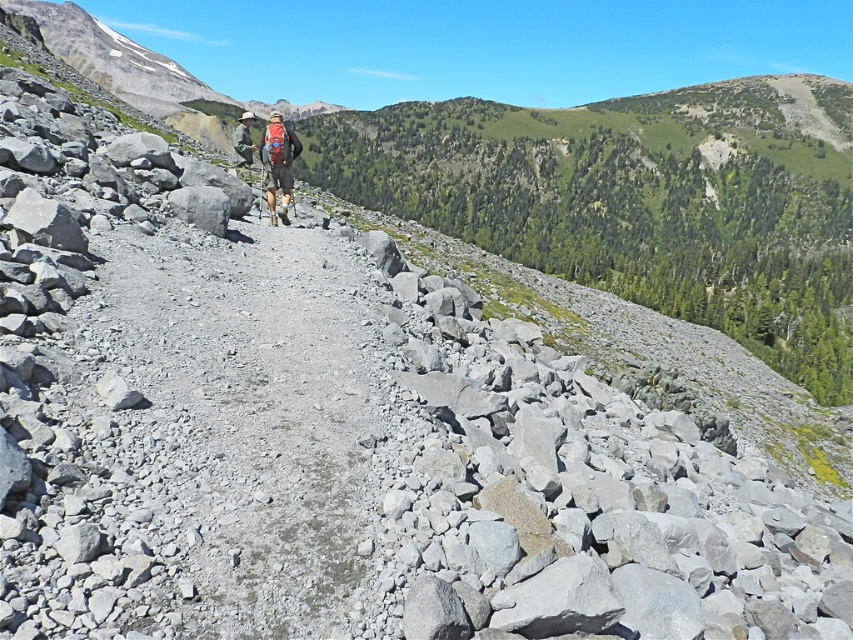
Question: Which object is positioned farthest from the camouflage fabric backpack at center?

Choices:
 (A) matte black backpack at center
 (B) gray gravel trail at center

Answer: (A)

Question: Can you confirm if matte black backpack at center is smaller than camouflage fabric backpack at center?

Choices:
 (A) no
 (B) yes

Answer: (B)

Question: Is gray gravel trail at center closer to the viewer compared to matte black backpack at center?

Choices:
 (A) yes
 (B) no

Answer: (A)

Question: Among these points, which one is nearest to the camera?

Choices:
 (A) (241, 157)
 (B) (274, 125)
 (C) (299, 586)

Answer: (C)

Question: Which of the following is the closest to the observer?

Choices:
 (A) gray gravel trail at center
 (B) camouflage fabric backpack at center
 (C) matte black backpack at center

Answer: (A)

Question: Does gray gravel trail at center come in front of camouflage fabric backpack at center?

Choices:
 (A) yes
 (B) no

Answer: (A)